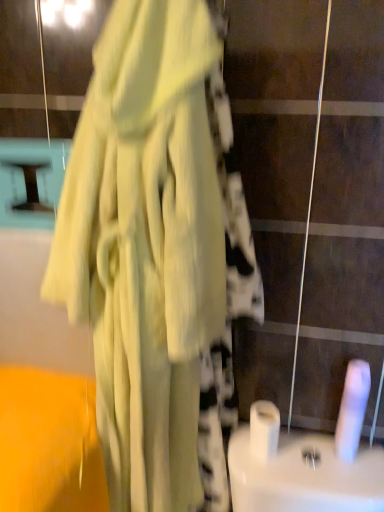
Question: Can you confirm if white matte toilet paper at lower right, which ranks as the second toilet paper in left-to-right order, is smaller than matte yellow dress at center?

Choices:
 (A) no
 (B) yes

Answer: (B)

Question: From a real-world perspective, is white matte toilet paper at lower right, which ranks as the second toilet paper in left-to-right order, on matte yellow dress at center?

Choices:
 (A) no
 (B) yes

Answer: (A)

Question: Does white matte toilet paper at lower right, which ranks as the second toilet paper in left-to-right order, turn towards matte yellow dress at center?

Choices:
 (A) no
 (B) yes

Answer: (A)

Question: Considering the relative sizes of white matte toilet paper at lower right, the first toilet paper when ordered from right to left, and matte yellow dress at center in the image provided, is white matte toilet paper at lower right, the first toilet paper when ordered from right to left, shorter than matte yellow dress at center?

Choices:
 (A) no
 (B) yes

Answer: (B)

Question: Is white matte toilet paper at lower right, the first toilet paper when ordered from right to left, positioned beyond the bounds of matte yellow dress at center?

Choices:
 (A) yes
 (B) no

Answer: (A)

Question: Is white matte toilet paper at lower right, the first toilet paper when ordered from right to left, positioned before matte yellow dress at center?

Choices:
 (A) no
 (B) yes

Answer: (A)

Question: From the image's perspective, does white matte toilet paper at lower right, which ranks as the second toilet paper in left-to-right order, appear lower than white glossy toilet paper at center, placed as the 1th toilet paper when sorted from left to right?

Choices:
 (A) yes
 (B) no

Answer: (B)

Question: Is white matte toilet paper at lower right, the first toilet paper when ordered from right to left, thinner than white glossy toilet paper at center, placed as the second toilet paper when sorted from right to left?

Choices:
 (A) yes
 (B) no

Answer: (A)

Question: Is the depth of white matte toilet paper at lower right, the first toilet paper when ordered from right to left, greater than that of white glossy toilet paper at center, placed as the 1th toilet paper when sorted from left to right?

Choices:
 (A) no
 (B) yes

Answer: (A)

Question: Is white glossy toilet paper at center, placed as the 1th toilet paper when sorted from left to right, at the back of white matte toilet paper at lower right, which ranks as the second toilet paper in left-to-right order?

Choices:
 (A) yes
 (B) no

Answer: (B)

Question: From a real-world perspective, is white matte toilet paper at lower right, which ranks as the second toilet paper in left-to-right order, physically below white glossy toilet paper at center, placed as the second toilet paper when sorted from right to left?

Choices:
 (A) yes
 (B) no

Answer: (B)

Question: From a real-world perspective, is white matte toilet paper at lower right, which ranks as the second toilet paper in left-to-right order, physically above white glossy toilet paper at center, placed as the second toilet paper when sorted from right to left?

Choices:
 (A) no
 (B) yes

Answer: (B)

Question: Is matte yellow dress at center at the back of white glossy toilet paper at center, placed as the 1th toilet paper when sorted from left to right?

Choices:
 (A) no
 (B) yes

Answer: (A)